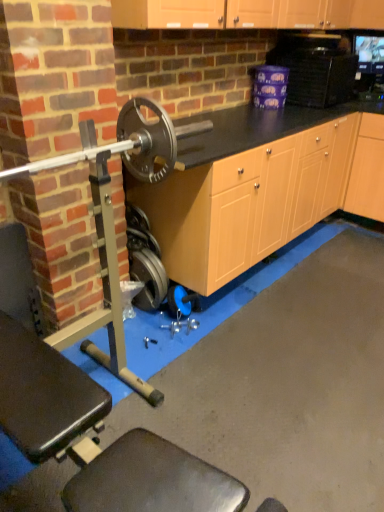
The image size is (384, 512). In order to click on black plastic microwave at upper right in this screenshot , I will do `click(315, 68)`.

Identify the location of polished silver barbell at left. The width and height of the screenshot is (384, 512). (113, 219).

The width and height of the screenshot is (384, 512). Identify the location of black plastic microwave at upper right. (315, 68).

Would you consider black plastic microwave at upper right to be distant from polished silver barbell at left?

Yes.

From the image's perspective, relative to polished silver barbell at left, is black plastic microwave at upper right above or below?

Based on their image positions, black plastic microwave at upper right is located above polished silver barbell at left.

Is black plastic microwave at upper right shorter than polished silver barbell at left?

Indeed, black plastic microwave at upper right has a lesser height compared to polished silver barbell at left.

Which object is wider, black plastic microwave at upper right or polished silver barbell at left?

black plastic microwave at upper right is wider.

Which of these two, black plastic microwave at upper right or metallic silver weight at lower center, stands taller?

metallic silver weight at lower center is taller.

From a real-world perspective, is black plastic microwave at upper right positioned over metallic silver weight at lower center based on gravity?

Yes.

Could you measure the distance between black plastic microwave at upper right and metallic silver weight at lower center?

They are 5.37 feet apart.

Which is behind, point (298, 85) or point (155, 291)?

The point (298, 85) is more distant.

Considering the relative positions of light wood cabinet at right and metallic silver weight at lower center in the image provided, is light wood cabinet at right behind metallic silver weight at lower center?

Yes, light wood cabinet at right is behind metallic silver weight at lower center.

From a real-world perspective, who is located lower, light wood cabinet at right or metallic silver weight at lower center?

In real-world perspective, metallic silver weight at lower center is lower.

This screenshot has height=512, width=384. What are the coordinates of `wheel that is under the light wood cabinet at right (from a real-world perspective)` in the screenshot? It's located at (148, 278).

Measure the distance between light wood cabinet at right and metallic silver weight at lower center.

They are 1.76 meters apart.

Considering the sizes of polished silver barbell at left and metallic silver weight at lower center in the image, is polished silver barbell at left bigger or smaller than metallic silver weight at lower center?

Considering their sizes, polished silver barbell at left takes up more space than metallic silver weight at lower center.

From a real-world perspective, does polished silver barbell at left stand above metallic silver weight at lower center?

Yes, from a real-world perspective, polished silver barbell at left is on top of metallic silver weight at lower center.

The height and width of the screenshot is (512, 384). I want to click on barbell located on the left of metallic silver weight at lower center, so click(x=113, y=219).

Which is more to the left, polished silver barbell at left or metallic silver weight at lower center?

polished silver barbell at left.

Which point is more forward, (332,59) or (377,147)?

The point (332,59) is more forward.

Based on the photo, is black plastic microwave at upper right behind light wood cabinet at right?

No, it is not.

Considering the relative sizes of black plastic microwave at upper right and light wood cabinet at right in the image provided, is black plastic microwave at upper right shorter than light wood cabinet at right?

Yes, black plastic microwave at upper right is shorter than light wood cabinet at right.

Is light wood cabinet at right surrounding polished silver barbell at left?

Definitely not — polished silver barbell at left is not inside light wood cabinet at right.

Considering the positions of objects light wood cabinet at right and polished silver barbell at left in the image provided, who is more to the left, light wood cabinet at right or polished silver barbell at left?

From the viewer's perspective, polished silver barbell at left appears more on the left side.

From a real-world perspective, is light wood cabinet at right physically located above or below polished silver barbell at left?

In terms of real-world spatial position, light wood cabinet at right is below polished silver barbell at left.

Is light wood cabinet at right oriented away from polished silver barbell at left?

No, light wood cabinet at right is not facing the opposite direction of polished silver barbell at left.

Does metallic silver weight at lower center have a smaller size compared to black plastic microwave at upper right?

Yes.

From the image's perspective, between metallic silver weight at lower center and black plastic microwave at upper right, who is located below?

metallic silver weight at lower center appears lower in the image.

Considering the relative positions of metallic silver weight at lower center and black plastic microwave at upper right in the image provided, is metallic silver weight at lower center to the right of black plastic microwave at upper right from the viewer's perspective?

Incorrect, metallic silver weight at lower center is not on the right side of black plastic microwave at upper right.

Is black plastic microwave at upper right at the back of metallic silver weight at lower center?

No, metallic silver weight at lower center's orientation is not away from black plastic microwave at upper right.

This screenshot has height=512, width=384. I want to click on barbell on the left of black plastic microwave at upper right, so (x=113, y=219).

You are a GUI agent. You are given a task and a screenshot of the screen. Output one action in this format:
    pyautogui.click(x=<x>, y=<y>)
    Task: Click on the wheel that is below the black plastic microwave at upper right (from the image's perspective)
    
    Given the screenshot: What is the action you would take?
    pyautogui.click(x=148, y=278)

From the image, which object appears to be nearer to polished silver barbell at left, metallic silver weight at lower center or black plastic microwave at upper right?

metallic silver weight at lower center lies closer to polished silver barbell at left than the other object.

When comparing their distances from metallic silver weight at lower center, does black plastic microwave at upper right or light wood cabinet at right seem closer?

Based on the image, black plastic microwave at upper right appears to be nearer to metallic silver weight at lower center.

Looking at the image, which one is located further to light wood cabinet at right, metallic silver weight at lower center or black plastic microwave at upper right?

The object further to light wood cabinet at right is metallic silver weight at lower center.

Considering their positions, is light wood cabinet at right positioned further to black plastic microwave at upper right than polished silver barbell at left?

polished silver barbell at left.

When comparing their distances from black plastic microwave at upper right, does metallic silver weight at lower center or light wood cabinet at right seem further?

metallic silver weight at lower center.

When comparing their distances from black plastic microwave at upper right, does metallic silver weight at lower center or polished silver barbell at left seem closer?

polished silver barbell at left is closer to black plastic microwave at upper right.

Estimate the real-world distances between objects in this image. Which object is closer to black plastic microwave at upper right, polished silver barbell at left or light wood cabinet at right?

light wood cabinet at right lies closer to black plastic microwave at upper right than the other object.

Estimate the real-world distances between objects in this image. Which object is closer to metallic silver weight at lower center, polished silver barbell at left or light wood cabinet at right?

polished silver barbell at left is closer to metallic silver weight at lower center.

What are the coordinates of `wheel between polished silver barbell at left and black plastic microwave at upper right from front to back` in the screenshot? It's located at coord(148,278).

Identify the location of appliance between metallic silver weight at lower center and light wood cabinet at right in the horizontal direction. (315, 68).

Find the location of a particular element. wheel between polished silver barbell at left and light wood cabinet at right in the horizontal direction is located at coordinates (148, 278).

I want to click on appliance between polished silver barbell at left and light wood cabinet at right in the front-back direction, so click(315, 68).